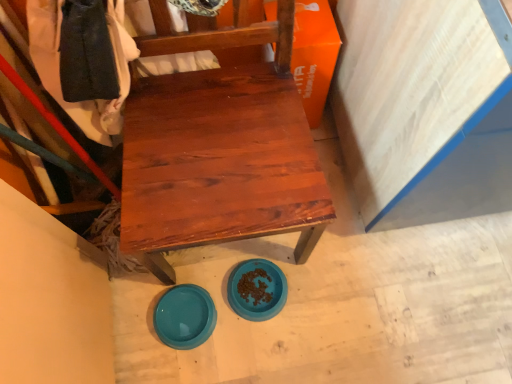
Question: Which direction should I rotate to look at blue plastic bowl at lower center, the 1th plate positioned from the right, — up or down?

Choices:
 (A) down
 (B) up

Answer: (A)

Question: Can you confirm if matte wood chair at center is thinner than orange matte cardboard box at upper right?

Choices:
 (A) yes
 (B) no

Answer: (B)

Question: Can you confirm if matte wood chair at center is bigger than orange matte cardboard box at upper right?

Choices:
 (A) no
 (B) yes

Answer: (B)

Question: Is matte wood chair at center at the left side of orange matte cardboard box at upper right?

Choices:
 (A) no
 (B) yes

Answer: (B)

Question: Can you confirm if matte wood chair at center is positioned to the right of orange matte cardboard box at upper right?

Choices:
 (A) no
 (B) yes

Answer: (A)

Question: From the image's perspective, is matte wood chair at center over orange matte cardboard box at upper right?

Choices:
 (A) yes
 (B) no

Answer: (B)

Question: Is matte wood chair at center located outside orange matte cardboard box at upper right?

Choices:
 (A) yes
 (B) no

Answer: (A)

Question: Is matte wood chair at center looking in the opposite direction of teal glossy plate at lower center, which is the second plate in right-to-left order?

Choices:
 (A) yes
 (B) no

Answer: (B)

Question: Is the depth of matte wood chair at center less than that of teal glossy plate at lower center, which is the second plate in right-to-left order?

Choices:
 (A) no
 (B) yes

Answer: (B)

Question: Is matte wood chair at center at the right side of teal glossy plate at lower center, arranged as the 1th plate when viewed from the left?

Choices:
 (A) no
 (B) yes

Answer: (B)

Question: Considering the relative positions of matte wood chair at center and teal glossy plate at lower center, arranged as the 1th plate when viewed from the left, in the image provided, is matte wood chair at center to the left of teal glossy plate at lower center, arranged as the 1th plate when viewed from the left, from the viewer's perspective?

Choices:
 (A) no
 (B) yes

Answer: (A)

Question: Is matte wood chair at center located outside teal glossy plate at lower center, arranged as the 1th plate when viewed from the left?

Choices:
 (A) yes
 (B) no

Answer: (A)

Question: Does matte wood chair at center have a lesser height compared to teal glossy plate at lower center, arranged as the 1th plate when viewed from the left?

Choices:
 (A) yes
 (B) no

Answer: (B)

Question: Does orange matte cardboard box at upper right appear on the left side of teal glossy plate at lower center, arranged as the 1th plate when viewed from the left?

Choices:
 (A) yes
 (B) no

Answer: (B)